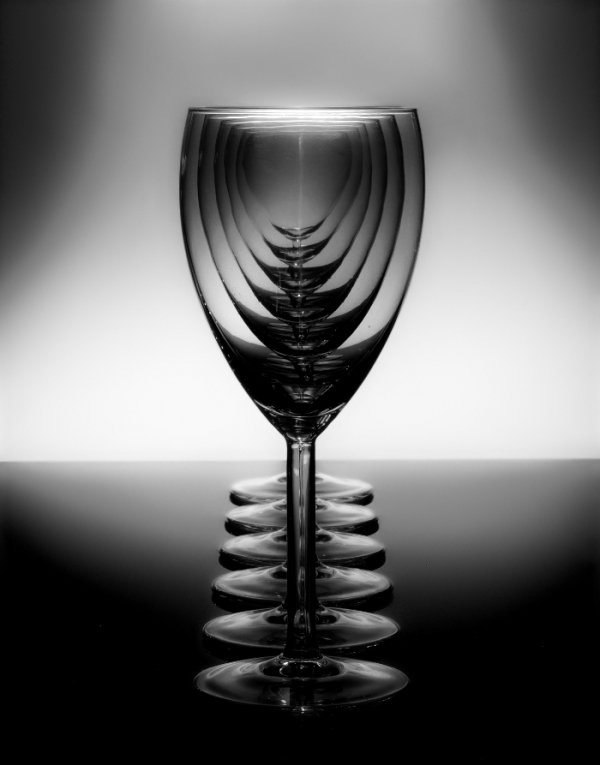
Where is `wine glasses`? This screenshot has height=765, width=600. wine glasses is located at coordinates (334, 486), (336, 509), (338, 552), (341, 588), (351, 635), (357, 682).